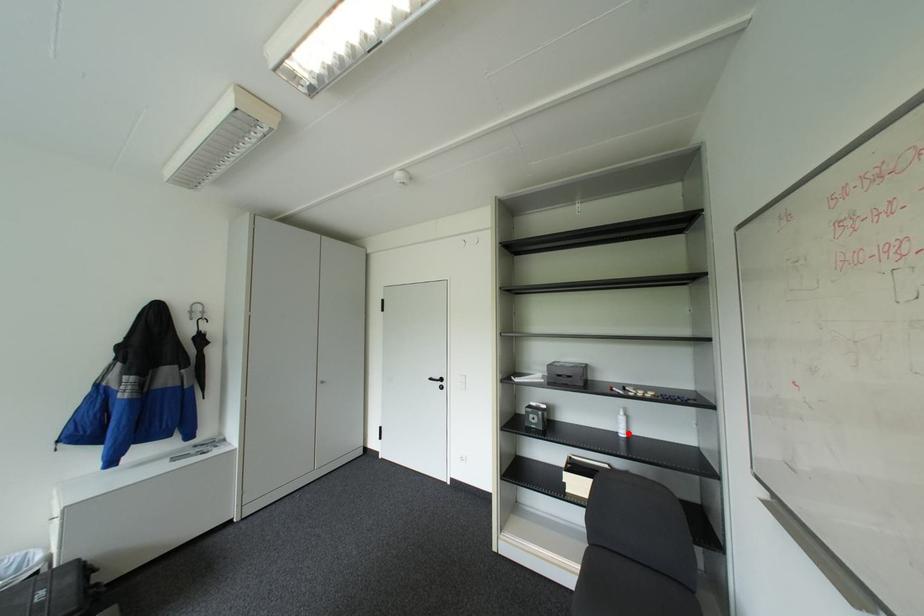
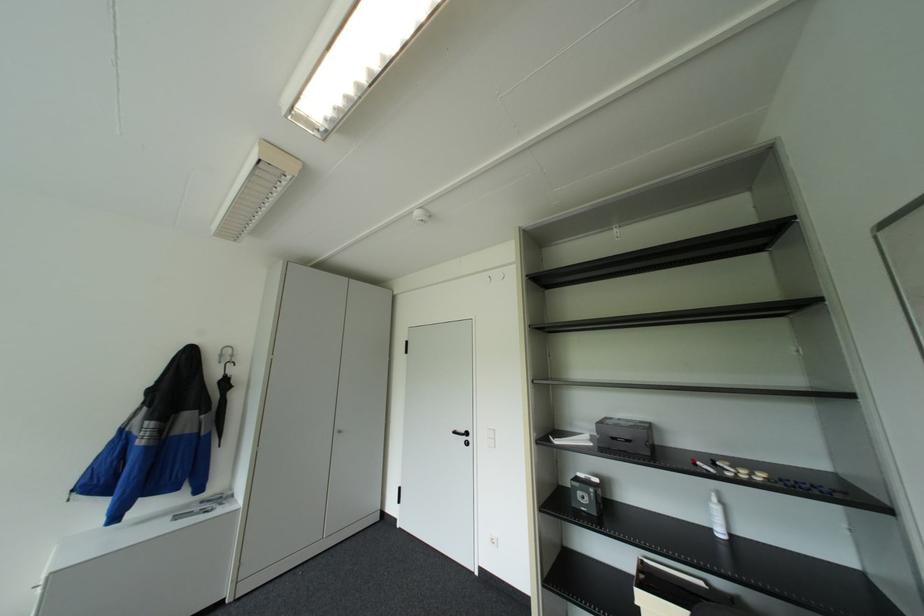
Question: I am providing you with two images of the same scene from different viewpoints. Given a red point in image1, look at the same physical point in image2. Is it:

Choices:
 (A) Closer to the viewpoint
 (B) Farther from the viewpoint

Answer: (A)